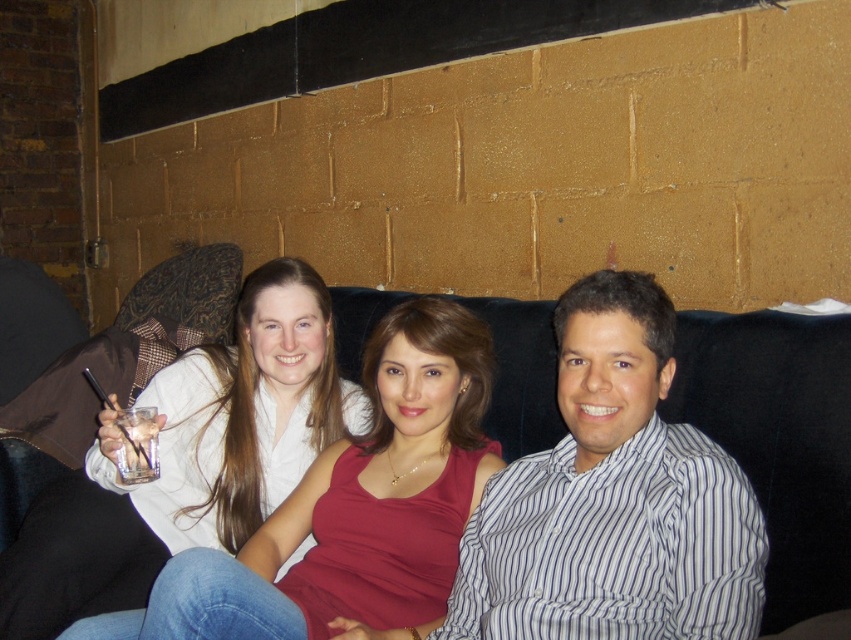
Does point (574, 531) come in front of point (500, 339)?

That is True.

Is white striped shirt at center closer to the viewer compared to black fabric couch at center?

That is True.

Between point (609, 296) and point (695, 365), which one is positioned in front?

Point (609, 296) is in front.

The width and height of the screenshot is (851, 640). I want to click on white striped shirt at center, so [614, 499].

Does point (304, 316) lie in front of point (688, 310)?

No, (304, 316) is further to viewer.

Who is shorter, white matte shirt at upper left or black fabric couch at center?

With less height is black fabric couch at center.

Between point (301, 285) and point (847, 560), which one is positioned in front?

Point (847, 560) is in front.

The width and height of the screenshot is (851, 640). In order to click on white matte shirt at upper left in this screenshot , I will do `click(189, 460)`.

Is white striped shirt at center closer to the viewer compared to white matte shirt at upper left?

That is True.

Is white striped shirt at center smaller than white matte shirt at upper left?

Yes, white striped shirt at center is smaller than white matte shirt at upper left.

You are a GUI agent. You are given a task and a screenshot of the screen. Output one action in this format:
    pyautogui.click(x=<x>, y=<y>)
    Task: Click on the white striped shirt at center
    
    Given the screenshot: What is the action you would take?
    pyautogui.click(x=614, y=499)